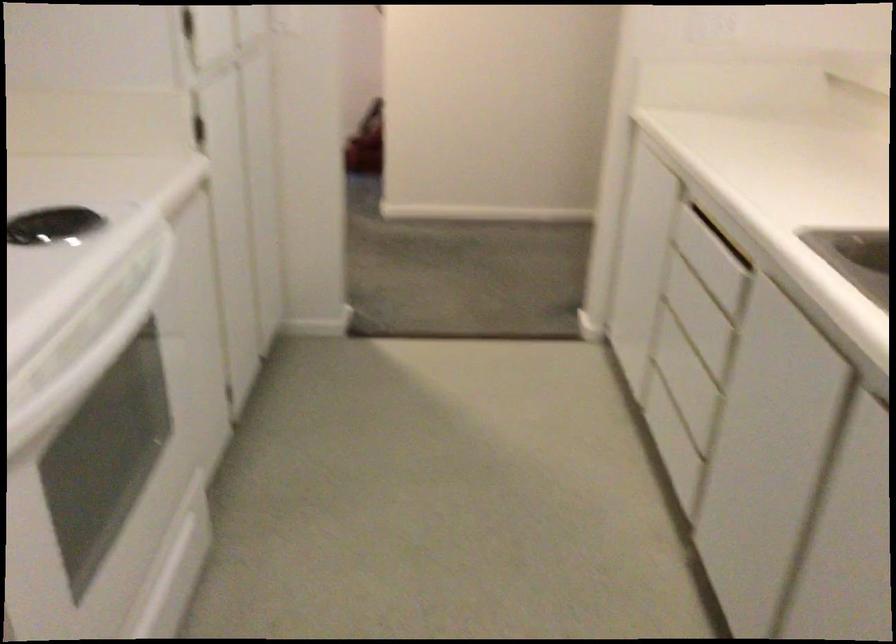
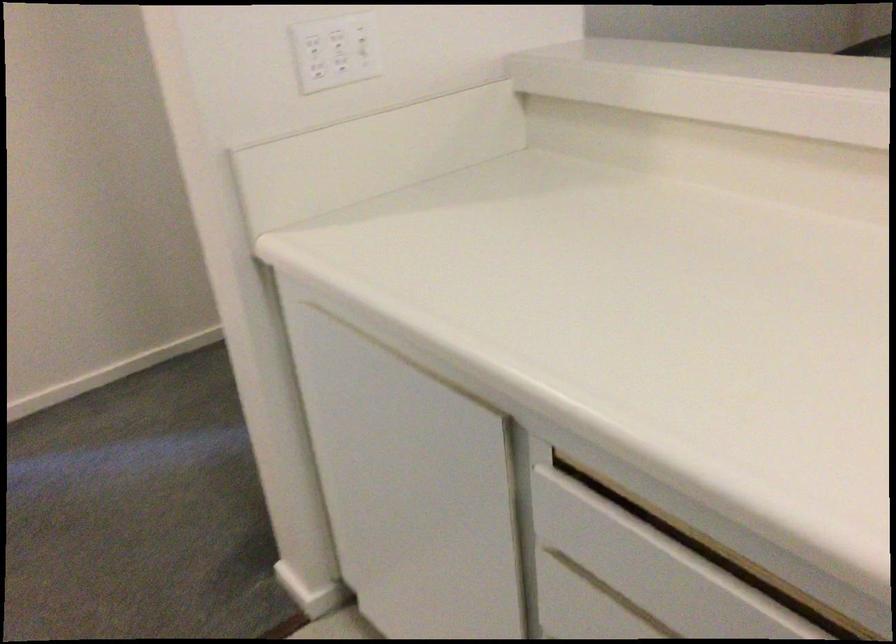
In the second image, find the point that corresponds to (699,251) in the first image.

(640, 574)